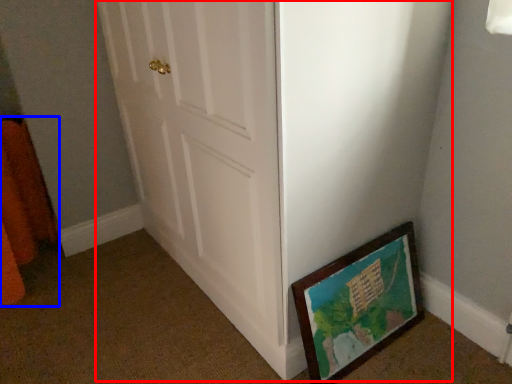
Question: Which point is further to the camera, door (highlighted by a red box) or curtain (highlighted by a blue box)?

Choices:
 (A) door
 (B) curtain

Answer: (B)